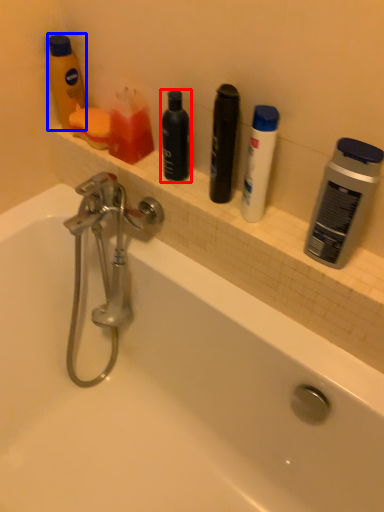
Question: Which object is further to the camera taking this photo, personal care (highlighted by a red box) or toiletry (highlighted by a blue box)?

Choices:
 (A) personal care
 (B) toiletry

Answer: (B)